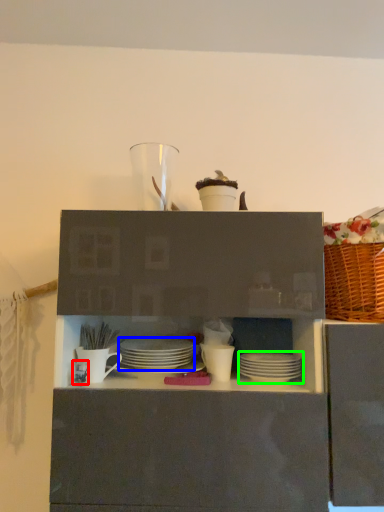
Question: Estimate the real-world distances between objects in this image. Which object is farther from tableware (highlighted by a red box), tableware (highlighted by a blue box) or tableware (highlighted by a green box)?

Choices:
 (A) tableware
 (B) tableware

Answer: (B)